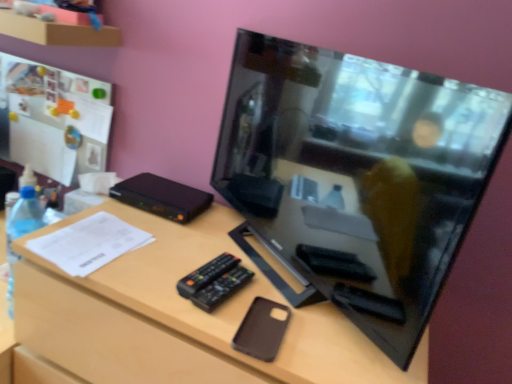
At what (x,y) coordinates should I click in order to perform the action: click on vacant area situated to the left side of black glossy television at center. Please return your answer as a coordinate pair (x, y). Looking at the image, I should click on (178, 244).